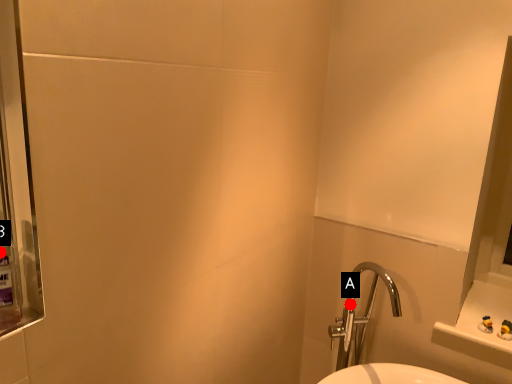
Question: Two points are circled on the image, labeled by A and B beside each circle. Among these points, which one is nearest to the camera?

Choices:
 (A) A is closer
 (B) B is closer

Answer: (B)